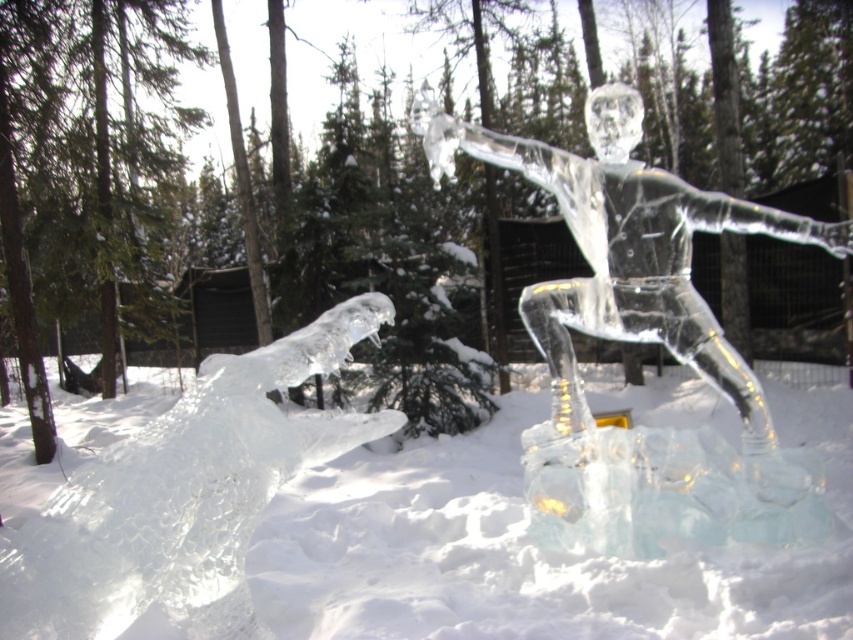
The image size is (853, 640). In order to click on clear ice figure at center in this screenshot , I will do `click(641, 340)`.

Is clear ice figure at center further to the viewer compared to clear ice dragon at lower left?

Yes, clear ice figure at center is further from the viewer.

Find the location of `clear ice figure at center`. clear ice figure at center is located at coordinates (641, 340).

I want to click on clear ice figure at center, so click(641, 340).

Looking at this image, is transparent ice sculpture at center behind clear ice dragon at lower left?

Yes, transparent ice sculpture at center is further from the viewer.

Does point (405, 595) lie behind point (54, 589)?

Yes.

Locate an element on the screen. This screenshot has width=853, height=640. transparent ice sculpture at center is located at coordinates (529, 548).

Which of these two, transparent ice sculpture at center or clear ice figure at center, stands taller?

Standing taller between the two is clear ice figure at center.

Which of these two, transparent ice sculpture at center or clear ice figure at center, stands shorter?

With less height is transparent ice sculpture at center.

Which is behind, point (363, 612) or point (833, 228)?

The point (833, 228) is more distant.

Locate an element on the screen. transparent ice sculpture at center is located at coordinates (529, 548).